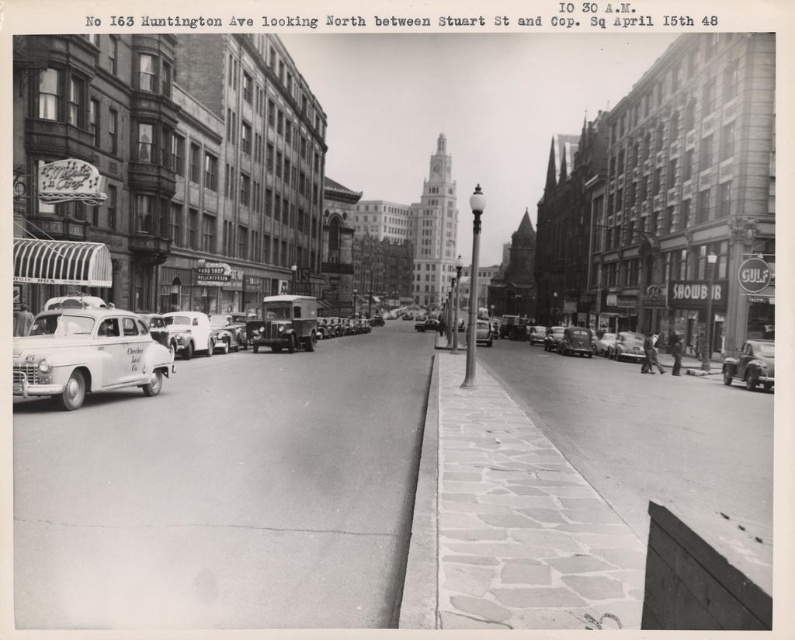
The width and height of the screenshot is (795, 640). Describe the element at coordinates (750, 364) in the screenshot. I see `shiny silver car at right` at that location.

Can you confirm if shiny silver car at right is positioned to the right of white matte van at center-left?

Correct, you'll find shiny silver car at right to the right of white matte van at center-left.

The height and width of the screenshot is (640, 795). What do you see at coordinates (750, 364) in the screenshot?
I see `shiny silver car at right` at bounding box center [750, 364].

The image size is (795, 640). I want to click on shiny silver car at right, so click(750, 364).

Is the position of white matte taxi at left more distant than that of white matte van at center-left?

No, it is in front of white matte van at center-left.

In the scene shown: Is white matte taxi at left thinner than white matte van at center-left?

In fact, white matte taxi at left might be wider than white matte van at center-left.

The width and height of the screenshot is (795, 640). What are the coordinates of `white matte taxi at left` in the screenshot? It's located at coord(87,355).

Can you confirm if white matte taxi at left is thinner than shiny silver car at right?

Correct, white matte taxi at left's width is less than shiny silver car at right's.

In the scene shown: Does white matte taxi at left have a larger size compared to shiny silver car at right?

Incorrect, white matte taxi at left is not larger than shiny silver car at right.

Between point (14, 346) and point (766, 369), which one is positioned behind?

Positioned behind is point (766, 369).

Locate an element on the screen. The image size is (795, 640). white matte taxi at left is located at coordinates (87, 355).